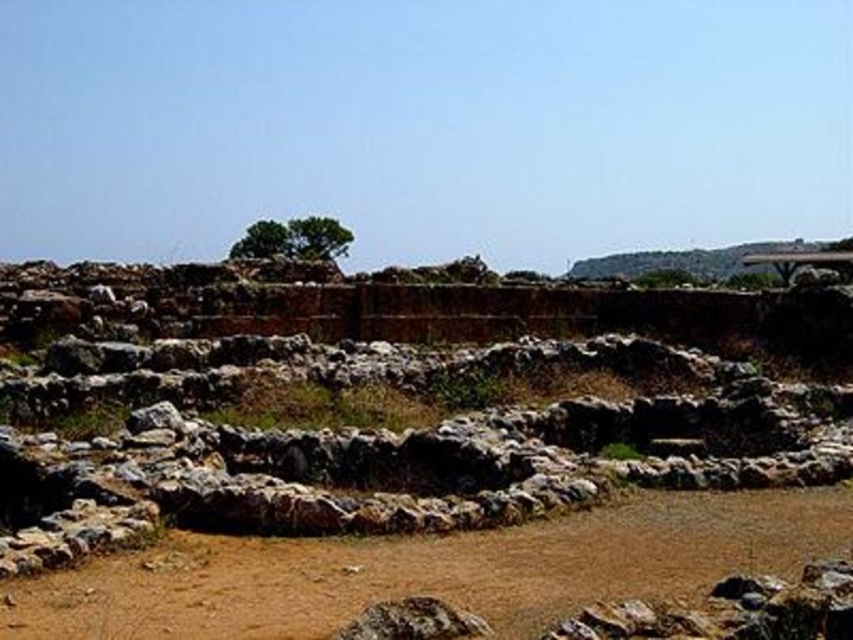
You are an archaeologist standing at the edge of an ancient site. You need to reach the brown dirt field at lower center to examine its composition. Given that your equipment is 3 meters wide, can you safely move across the area between you and the field without damaging the site?

The distance between you and the brown dirt field at lower center is 115.91 feet, which is approximately 35.33 meters. Since your equipment is only 3 meters wide, there is sufficient space to move safely without damaging the site.

You are an archaeologist examining the site. You need to place a 3m wide protective barrier between the brown dirt field at lower center and the green leafy tree at center. Is the space between them wide enough for the barrier?

The brown dirt field at lower center has a lesser width compared to green leafy tree at center. Therefore, the space between them may not be sufficient to accommodate a 3m wide barrier. You should measure the actual distance before proceeding.

You are an archaeologist examining the site. You notice the brown dirt field at lower center and the green leafy tree at center. Which area covers a smaller portion of the image?

The brown dirt field at lower center occupies less space than the green leafy tree at center, so the brown dirt field at lower center covers a smaller portion of the image.